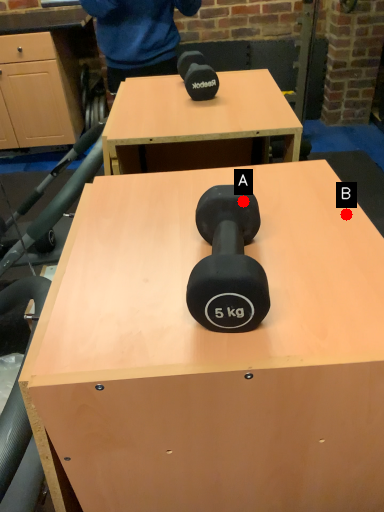
Question: Two points are circled on the image, labeled by A and B beside each circle. Which point is farther from the camera taking this photo?

Choices:
 (A) A is further
 (B) B is further

Answer: (B)